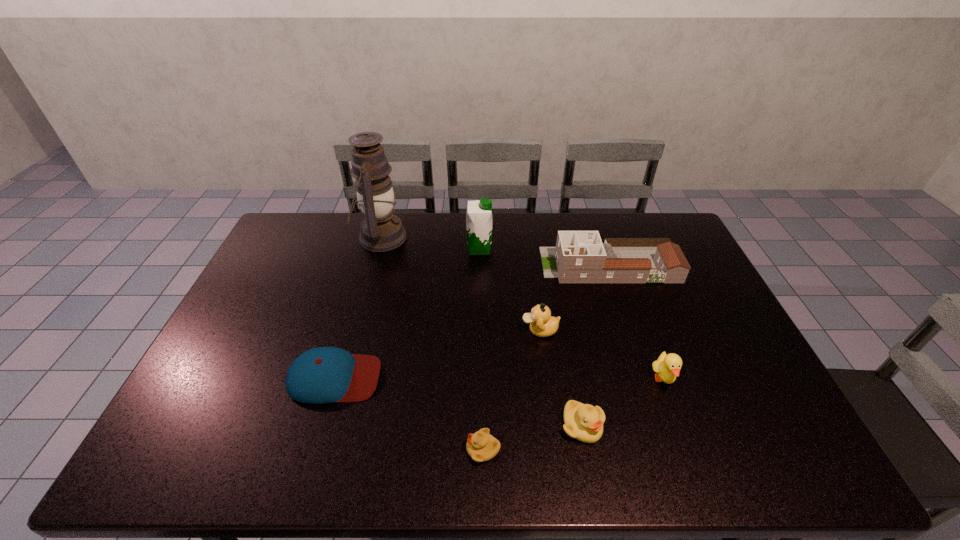
Identify the location of vacant space that's between the farthest duckling and the second farthest duckling. The height and width of the screenshot is (540, 960). (x=602, y=355).

Identify which object is the nearest to the third nearest duckling. Please provide its 2D coordinates. Your answer should be formatted as a tuple, i.e. [(x, y)], where the tuple contains the x and y coordinates of a point satisfying the conditions above.

[(584, 422)]

Identify which object is the fifth closest to the baseball cap. Please provide its 2D coordinates. Your answer should be formatted as a tuple, i.e. [(x, y)], where the tuple contains the x and y coordinates of a point satisfying the conditions above.

[(479, 221)]

Locate an element on the screen. duckling that is the third nearest to the leftmost duckling is located at coordinates (667, 367).

Select which duckling is the closest to the soya milk. Please provide its 2D coordinates. Your answer should be formatted as a tuple, i.e. [(x, y)], where the tuple contains the x and y coordinates of a point satisfying the conditions above.

[(542, 324)]

Locate an element on the screen. The width and height of the screenshot is (960, 540). vacant space that satisfies the following two spatial constraints: 1. on the front-facing side of the second shortest duckling; 2. on the front-facing side of the shortest object is located at coordinates (587, 449).